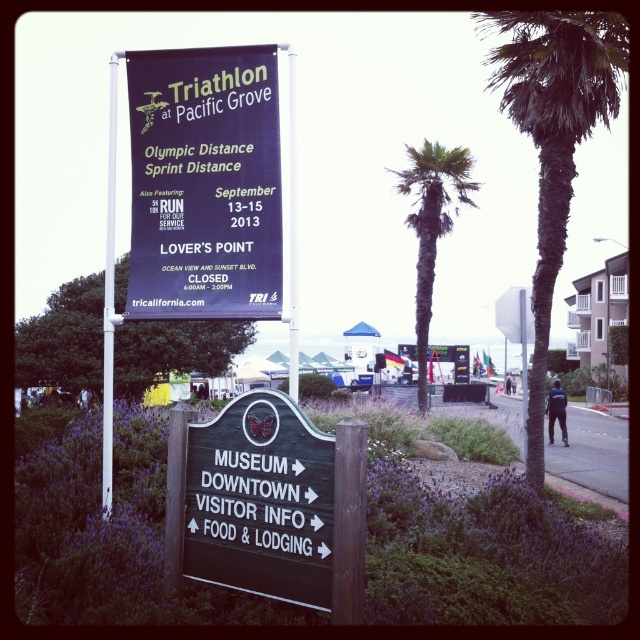
Between green leafy palm tree at center and white plastic pole at upper center, which one has more height?

green leafy palm tree at center

Is green leafy palm tree at center taller than white plastic pole at upper center?

Indeed, green leafy palm tree at center has a greater height compared to white plastic pole at upper center.

The image size is (640, 640). Describe the element at coordinates (432, 225) in the screenshot. I see `green leafy palm tree at center` at that location.

The width and height of the screenshot is (640, 640). I want to click on green leafy palm tree at center, so click(x=432, y=225).

Is dark purple banner at center to the right of green leafy palm tree at center from the viewer's perspective?

In fact, dark purple banner at center is to the left of green leafy palm tree at center.

Is dark purple banner at center positioned behind green leafy palm tree at center?

No, dark purple banner at center is closer to the viewer.

I want to click on dark purple banner at center, so pyautogui.click(x=204, y=182).

Consider the image. Between green leafy palm tree at right and green leafy palm tree at center, which one appears on the right side from the viewer's perspective?

Positioned to the right is green leafy palm tree at right.

Does point (557, 115) lie in front of point (422, 186)?

Yes.

I want to click on green leafy palm tree at right, so click(x=554, y=140).